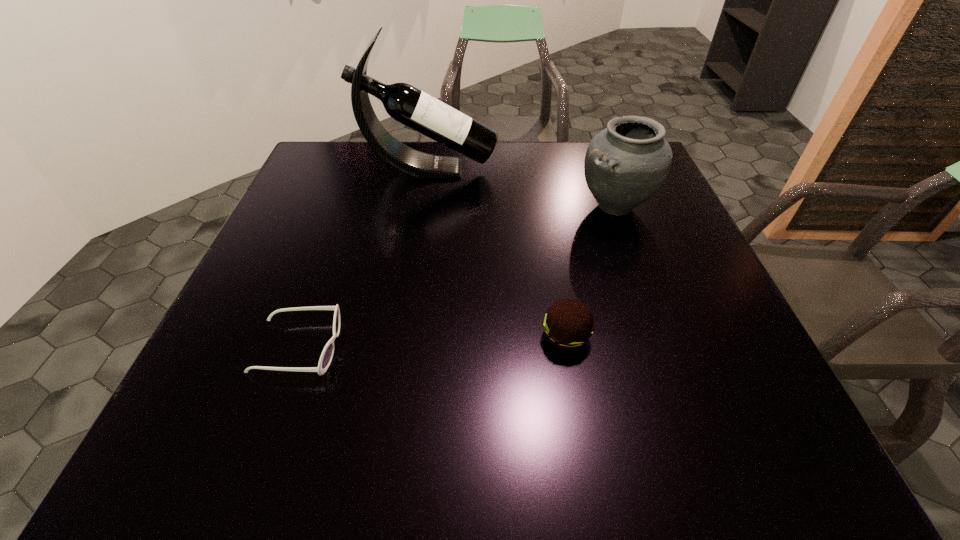
The width and height of the screenshot is (960, 540). I want to click on free space that satisfies the following two spatial constraints: 1. on the stand of the third object from left to right; 2. on the left side of the farthest object, so click(403, 336).

This screenshot has width=960, height=540. Identify the location of vacant space that satisfies the following two spatial constraints: 1. on the back side of the second tallest object; 2. on the stand of the farthest object. (602, 169).

I want to click on free space that satisfies the following two spatial constraints: 1. on the front side of the patty; 2. with the lenses of the sunglasses facing outward, so click(567, 347).